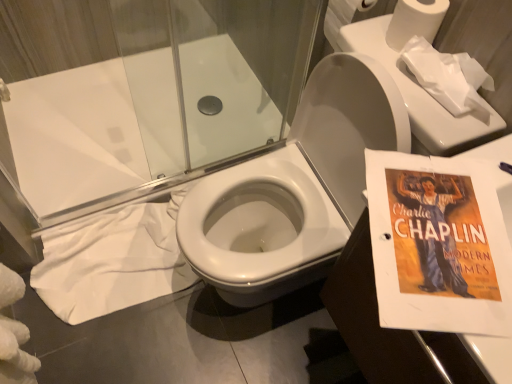
This screenshot has height=384, width=512. What are the coordinates of `white paper at upper right, which is counted as the third toilet paper, starting from the front` in the screenshot? It's located at (342, 19).

What do you see at coordinates (113, 261) in the screenshot? The height and width of the screenshot is (384, 512). I see `white fabric at lower left` at bounding box center [113, 261].

What are the coordinates of `transparent glass shower door at upper center` in the screenshot? It's located at (155, 92).

Image resolution: width=512 pixels, height=384 pixels. Describe the element at coordinates (155, 92) in the screenshot. I see `transparent glass shower door at upper center` at that location.

The width and height of the screenshot is (512, 384). Describe the element at coordinates (447, 76) in the screenshot. I see `white paper at upper right, which is counted as the 3th toilet paper, starting from the back` at that location.

Image resolution: width=512 pixels, height=384 pixels. Describe the element at coordinates (438, 245) in the screenshot. I see `matte paper charlie chaplin poster at right` at that location.

This screenshot has width=512, height=384. What are the coordinates of `white paper at upper right, which is counted as the third toilet paper, starting from the front` in the screenshot? It's located at coord(342,19).

Based on the photo, is white paper at upper right, which is counted as the first toilet paper, starting from the back, not inside transparent glass shower door at upper center?

Yes, white paper at upper right, which is counted as the first toilet paper, starting from the back, is located beyond the bounds of transparent glass shower door at upper center.

Are white paper at upper right, which is counted as the third toilet paper, starting from the front, and transparent glass shower door at upper center beside each other?

There is a gap between white paper at upper right, which is counted as the third toilet paper, starting from the front, and transparent glass shower door at upper center.

From the image's perspective, who appears lower, white paper at upper right, which is counted as the first toilet paper, starting from the back, or transparent glass shower door at upper center?

From the image's view, transparent glass shower door at upper center is below.

Is white paper at upper right, which is counted as the first toilet paper, starting from the back, to the left or to the right of transparent glass shower door at upper center in the image?

In the image, white paper at upper right, which is counted as the first toilet paper, starting from the back, appears on the right side of transparent glass shower door at upper center.

Considering the points (151, 277) and (331, 13), which point is in front, point (151, 277) or point (331, 13)?

The point (331, 13) is closer.

What's the angular difference between white fabric at lower left and white paper at upper right, which is counted as the first toilet paper, starting from the back,'s facing directions?

The facing directions of white fabric at lower left and white paper at upper right, which is counted as the first toilet paper, starting from the back, are 86.3 degrees apart.

From the picture: From the image's perspective, is white fabric at lower left positioned above or below white paper at upper right, which is counted as the first toilet paper, starting from the back?

Clearly, from the image's perspective, white fabric at lower left is below white paper at upper right, which is counted as the first toilet paper, starting from the back.

Which is more to the left, white fabric at lower left or white paper at upper right, which is counted as the third toilet paper, starting from the front?

white fabric at lower left is more to the left.

Between point (477, 111) and point (368, 181), which one is positioned behind?

The point (477, 111) is more distant.

From the image's perspective, which object appears higher, white paper at upper right, which is counted as the 3th toilet paper, starting from the back, or matte paper charlie chaplin poster at right?

white paper at upper right, which is counted as the 3th toilet paper, starting from the back.

Is white paper at upper right, which appears as the 1th toilet paper when viewed from the front, beside matte paper charlie chaplin poster at right?

white paper at upper right, which appears as the 1th toilet paper when viewed from the front, is not next to matte paper charlie chaplin poster at right, and they're not touching.

Looking at this image, which of these two, white paper at upper right, which is counted as the 3th toilet paper, starting from the back, or matte paper charlie chaplin poster at right, stands shorter?

white paper at upper right, which is counted as the 3th toilet paper, starting from the back, is shorter.

Is white fabric at lower left far away from white matte toilet paper at upper right, the second toilet paper viewed from the front?

Absolutely, white fabric at lower left is distant from white matte toilet paper at upper right, the second toilet paper viewed from the front.

Is white fabric at lower left completely or partially outside of white matte toilet paper at upper right, which is the 2th toilet paper from back to front?

white fabric at lower left lies outside white matte toilet paper at upper right, which is the 2th toilet paper from back to front,'s area.

Does white fabric at lower left appear on the left side of white matte toilet paper at upper right, the second toilet paper viewed from the front?

Indeed, white fabric at lower left is positioned on the left side of white matte toilet paper at upper right, the second toilet paper viewed from the front.

From a real-world perspective, is white fabric at lower left above or below white matte toilet paper at upper right, which is the 2th toilet paper from back to front?

white fabric at lower left is situated lower than white matte toilet paper at upper right, which is the 2th toilet paper from back to front, in the real world.

Could you measure the distance between white matte toilet paper at upper right, which is the 2th toilet paper from back to front, and white paper at upper right, which appears as the 1th toilet paper when viewed from the front?

white matte toilet paper at upper right, which is the 2th toilet paper from back to front, is 3.15 inches from white paper at upper right, which appears as the 1th toilet paper when viewed from the front.

From a real-world perspective, which is physically below, white matte toilet paper at upper right, the second toilet paper viewed from the front, or white paper at upper right, which appears as the 1th toilet paper when viewed from the front?

white paper at upper right, which appears as the 1th toilet paper when viewed from the front, from a real-world perspective.

Is white matte toilet paper at upper right, the second toilet paper viewed from the front, aimed at white paper at upper right, which appears as the 1th toilet paper when viewed from the front?

No, white matte toilet paper at upper right, the second toilet paper viewed from the front, is not aimed at white paper at upper right, which appears as the 1th toilet paper when viewed from the front.

In terms of size, does white matte toilet paper at upper right, the second toilet paper viewed from the front, appear bigger or smaller than white paper at upper right, which is counted as the 3th toilet paper, starting from the back?

Clearly, white matte toilet paper at upper right, the second toilet paper viewed from the front, is smaller in size than white paper at upper right, which is counted as the 3th toilet paper, starting from the back.

Consider the image. Is white matte toilet paper at upper right, which is the 2th toilet paper from back to front, situated inside matte paper charlie chaplin poster at right or outside?

white matte toilet paper at upper right, which is the 2th toilet paper from back to front, lies outside matte paper charlie chaplin poster at right.

Is white matte toilet paper at upper right, the second toilet paper viewed from the front, not close to matte paper charlie chaplin poster at right?

Actually, white matte toilet paper at upper right, the second toilet paper viewed from the front, and matte paper charlie chaplin poster at right are a little close together.

From a real-world perspective, which is physically below, white matte toilet paper at upper right, the second toilet paper viewed from the front, or matte paper charlie chaplin poster at right?

matte paper charlie chaplin poster at right is physically lower.

I want to click on the 2nd toilet paper to the left of the matte paper charlie chaplin poster at right, starting your count from the anchor, so click(x=415, y=21).

Locate an element on the screen. The height and width of the screenshot is (384, 512). the 2nd toilet paper to the right of the white paper at upper right, which is counted as the third toilet paper, starting from the front, starting your count from the anchor is located at coordinates (447, 76).

In the scene shown: How many degrees apart are the facing directions of white paper at upper right, which appears as the 1th toilet paper when viewed from the front, and white paper at upper right, which is counted as the first toilet paper, starting from the back?

white paper at upper right, which appears as the 1th toilet paper when viewed from the front, and white paper at upper right, which is counted as the first toilet paper, starting from the back, are facing 2.81 degrees away from each other.

Is white paper at upper right, which appears as the 1th toilet paper when viewed from the front, aimed at white paper at upper right, which is counted as the third toilet paper, starting from the front?

No, white paper at upper right, which appears as the 1th toilet paper when viewed from the front, is not oriented towards white paper at upper right, which is counted as the third toilet paper, starting from the front.

Is white paper at upper right, which is counted as the third toilet paper, starting from the front, surrounded by white paper at upper right, which is counted as the 3th toilet paper, starting from the back?

That's incorrect, white paper at upper right, which is counted as the third toilet paper, starting from the front, is not inside white paper at upper right, which is counted as the 3th toilet paper, starting from the back.

The height and width of the screenshot is (384, 512). Identify the location of toilet paper that is the 1st object to the right of the transparent glass shower door at upper center, starting at the anchor. (342, 19).

Where is `toilet paper that is the 1st one above the white fabric at lower left (from a real-world perspective)`? The height and width of the screenshot is (384, 512). toilet paper that is the 1st one above the white fabric at lower left (from a real-world perspective) is located at coordinates (342, 19).

Looking at the image, which one is located further to white paper at upper right, which is counted as the first toilet paper, starting from the back, white matte toilet paper at upper right, which is the 2th toilet paper from back to front, or matte paper charlie chaplin poster at right?

matte paper charlie chaplin poster at right.

Which object lies further to the anchor point white paper at upper right, which is counted as the third toilet paper, starting from the front, matte paper charlie chaplin poster at right or white fabric at lower left?

white fabric at lower left lies further to white paper at upper right, which is counted as the third toilet paper, starting from the front, than the other object.

Looking at the image, which one is located closer to white matte toilet paper at upper right, the second toilet paper viewed from the front, white paper at upper right, which is counted as the 3th toilet paper, starting from the back, or matte paper charlie chaplin poster at right?

The object closer to white matte toilet paper at upper right, the second toilet paper viewed from the front, is white paper at upper right, which is counted as the 3th toilet paper, starting from the back.

From the image, which object appears to be farther from white paper at upper right, which appears as the 1th toilet paper when viewed from the front, white matte toilet paper at upper right, the second toilet paper viewed from the front, or white paper at upper right, which is counted as the first toilet paper, starting from the back?

Among the two, white paper at upper right, which is counted as the first toilet paper, starting from the back, is located further to white paper at upper right, which appears as the 1th toilet paper when viewed from the front.

In the scene shown: Considering their positions, is white paper at upper right, which is counted as the 3th toilet paper, starting from the back, positioned closer to white paper at upper right, which is counted as the first toilet paper, starting from the back, than white matte toilet paper at upper right, the second toilet paper viewed from the front?

white matte toilet paper at upper right, the second toilet paper viewed from the front, is positioned closer to the anchor white paper at upper right, which is counted as the first toilet paper, starting from the back.

In the scene shown: From the image, which object appears to be nearer to white matte toilet paper at upper right, which is the 2th toilet paper from back to front, matte paper charlie chaplin poster at right or transparent glass shower door at upper center?

matte paper charlie chaplin poster at right.

Which object lies further to the anchor point white paper at upper right, which is counted as the 3th toilet paper, starting from the back, white fabric at lower left or white paper at upper right, which is counted as the first toilet paper, starting from the back?

white fabric at lower left is further to white paper at upper right, which is counted as the 3th toilet paper, starting from the back.

Estimate the real-world distances between objects in this image. Which object is further from transparent glass shower door at upper center, white paper at upper right, which appears as the 1th toilet paper when viewed from the front, or white paper at upper right, which is counted as the first toilet paper, starting from the back?

Based on the image, white paper at upper right, which appears as the 1th toilet paper when viewed from the front, appears to be further to transparent glass shower door at upper center.

I want to click on toilet paper between white paper at upper right, which is counted as the first toilet paper, starting from the back, and white paper at upper right, which appears as the 1th toilet paper when viewed from the front, from top to bottom, so click(x=415, y=21).

Image resolution: width=512 pixels, height=384 pixels. What are the coordinates of `shower door between white fabric at lower left and white matte toilet paper at upper right, the second toilet paper viewed from the front, from left to right` in the screenshot? It's located at (155, 92).

Where is `toilet paper between white fabric at lower left and white matte toilet paper at upper right, the second toilet paper viewed from the front`? This screenshot has width=512, height=384. toilet paper between white fabric at lower left and white matte toilet paper at upper right, the second toilet paper viewed from the front is located at coordinates (342, 19).

Locate an element on the screen. The image size is (512, 384). shower door between white fabric at lower left and white paper at upper right, which is counted as the first toilet paper, starting from the back is located at coordinates (155, 92).